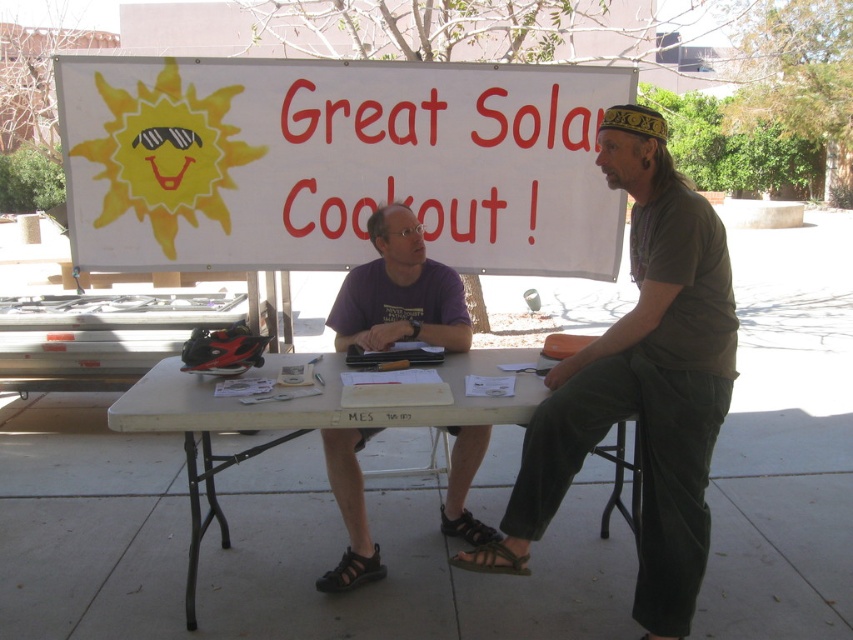
Does point (451, 472) come behind point (368, 579)?

Yes, it is.

Who is positioned more to the right, purple cotton shirt at center or black rubber sandal at lower center?

Positioned to the right is purple cotton shirt at center.

Is point (456, 499) in front of point (354, 584)?

No, it is behind (354, 584).

The width and height of the screenshot is (853, 640). Find the location of `purple cotton shirt at center`. purple cotton shirt at center is located at coordinates (399, 292).

Is white plastic table at center bigger than black leather sandal at lower center?

Correct, white plastic table at center is larger in size than black leather sandal at lower center.

Find the location of a particular element. The image size is (853, 640). white plastic table at center is located at coordinates (293, 420).

Find the location of a particular element. The height and width of the screenshot is (640, 853). white plastic table at center is located at coordinates (293, 420).

At what (x,y) coordinates should I click in order to perform the action: click on white plastic table at center. Please return your answer as a coordinate pair (x, y). The image size is (853, 640). Looking at the image, I should click on (293, 420).

Does point (468, 406) lie in front of point (337, 586)?

Yes, point (468, 406) is closer to viewer.

Between point (525, 388) and point (346, 588), which one is positioned in front?

Point (525, 388)

You are a GUI agent. You are given a task and a screenshot of the screen. Output one action in this format:
    pyautogui.click(x=<x>, y=<y>)
    Task: Click on the white plastic table at center
    This screenshot has width=853, height=640.
    Given the screenshot: What is the action you would take?
    click(x=293, y=420)